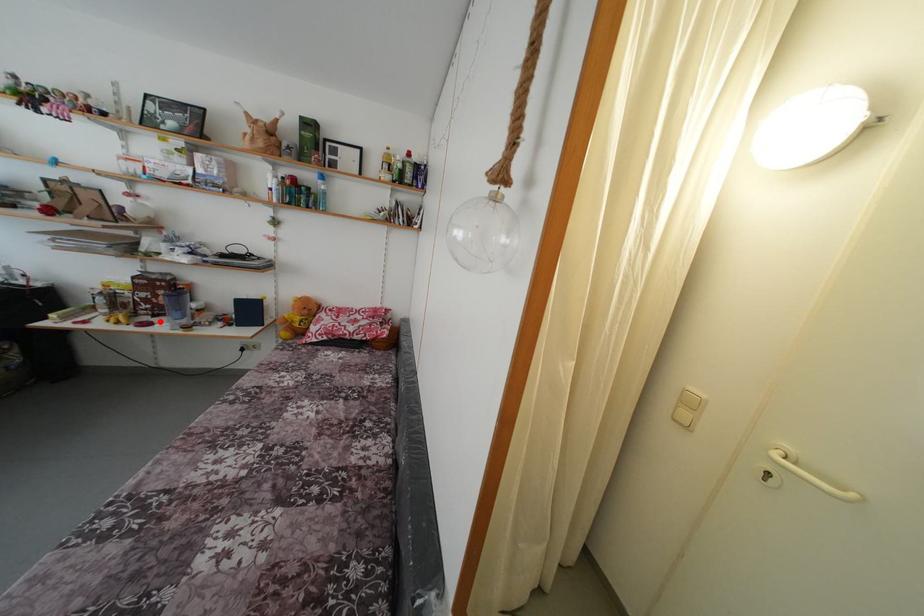
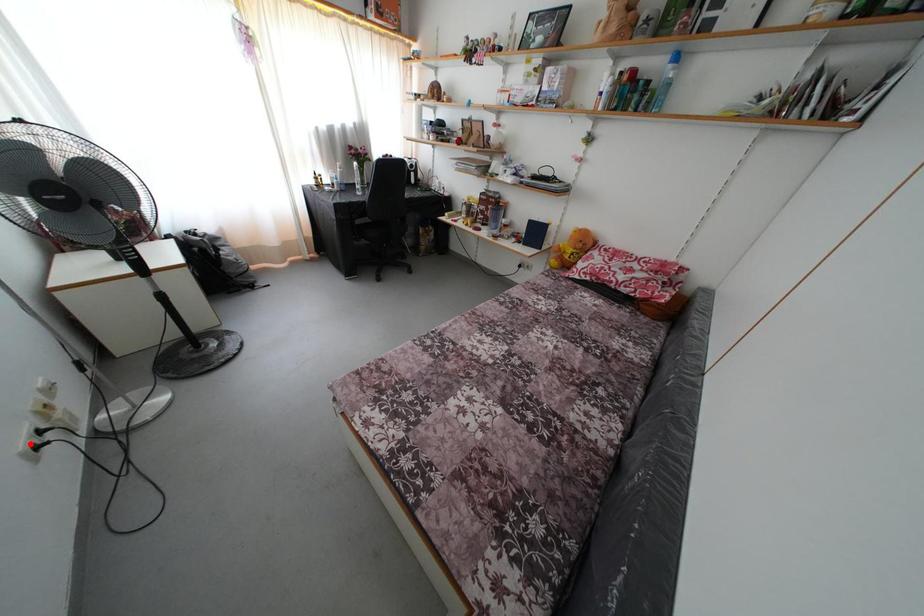
I am providing you with two images of the same scene from different viewpoints. A red point is marked on the first image and another point is marked on the second image. Are the points marked in image1 and image2 representing the same 3D position?

No